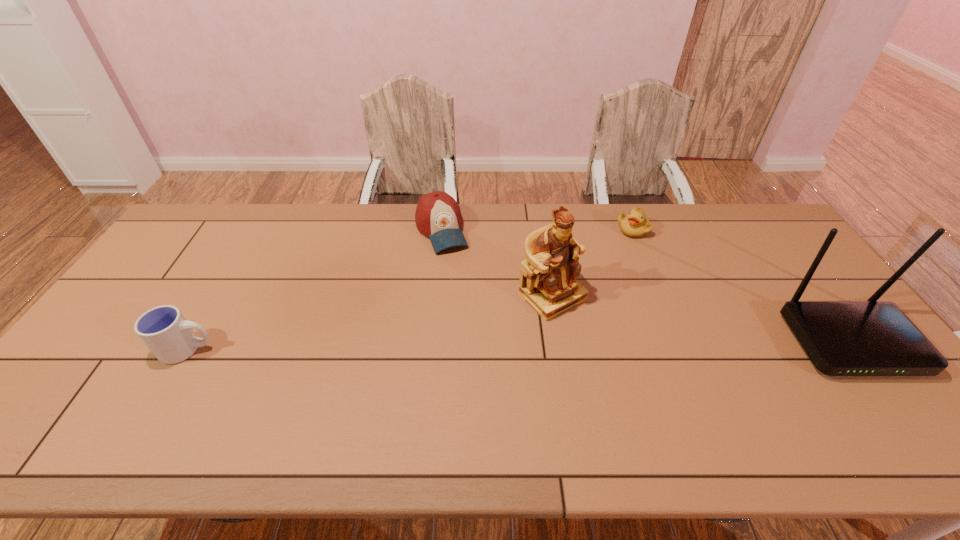
Locate an element on the screen. Image resolution: width=960 pixels, height=540 pixels. empty location between the fourth object from right to left and the shortest object is located at coordinates (538, 230).

Locate an element on the screen. The height and width of the screenshot is (540, 960). empty space between the fourth object from right to left and the third object from left to right is located at coordinates (497, 263).

The image size is (960, 540). I want to click on free space between the fourth object from right to left and the rightmost object, so tap(645, 286).

This screenshot has height=540, width=960. Find the location of `free space between the cup and the third object from right to left`. free space between the cup and the third object from right to left is located at coordinates (371, 323).

Identify the location of the fourth closest object to the baseball cap. The height and width of the screenshot is (540, 960). (842, 338).

Identify which object is the nearest to the figurine. Please provide its 2D coordinates. Your answer should be formatted as a tuple, i.e. [(x, y)], where the tuple contains the x and y coordinates of a point satisfying the conditions above.

[(438, 216)]